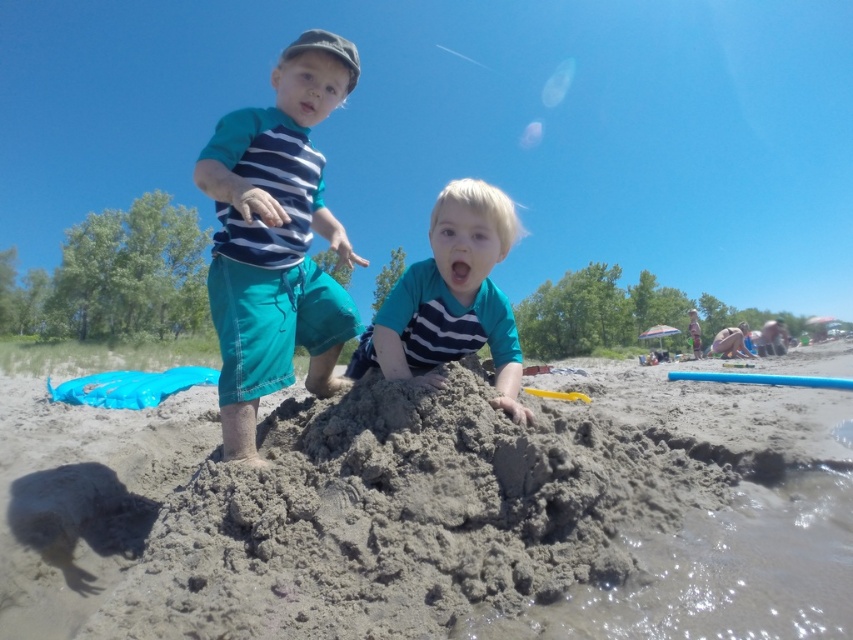
Question: Which point is farther from the camera taking this photo?

Choices:
 (A) (288, 104)
 (B) (784, 458)
 (C) (451, 337)

Answer: (B)

Question: Can you confirm if matte blue shorts at center is positioned below matte teal shirt at center?

Choices:
 (A) yes
 (B) no

Answer: (B)

Question: Considering the relative positions of gray sandcastle at center and matte teal shirt at center in the image provided, where is gray sandcastle at center located with respect to matte teal shirt at center?

Choices:
 (A) right
 (B) left

Answer: (A)

Question: Considering the relative positions of gray sandcastle at center and matte teal shirt at center in the image provided, where is gray sandcastle at center located with respect to matte teal shirt at center?

Choices:
 (A) above
 (B) below

Answer: (B)

Question: Estimate the real-world distances between objects in this image. Which object is closer to the matte blue shorts at center?

Choices:
 (A) gray sandcastle at center
 (B) matte teal shirt at center

Answer: (B)

Question: Which object is positioned closest to the matte teal shirt at center?

Choices:
 (A) matte blue shorts at center
 (B) gray sandcastle at center

Answer: (A)